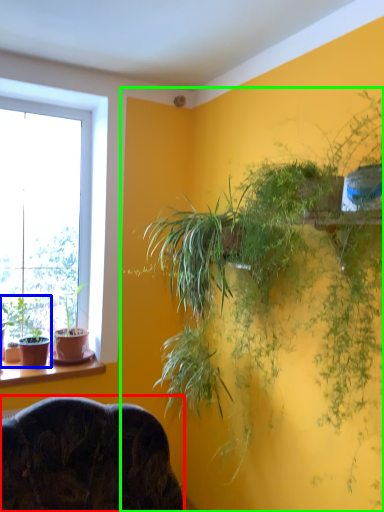
Question: Which object is positioned closest to furniture (highlighted by a red box)? Select from houseplant (highlighted by a blue box) and houseplant (highlighted by a green box).

Choices:
 (A) houseplant
 (B) houseplant

Answer: (A)